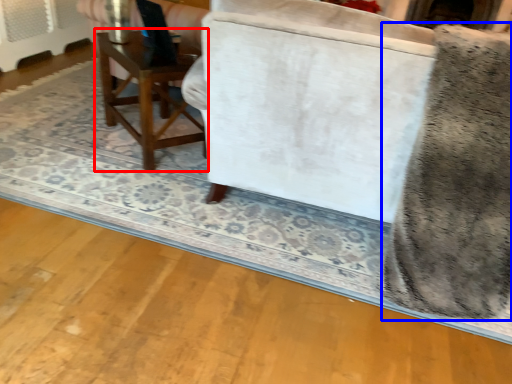
Question: Which point is closer to the camera, table (highlighted by a red box) or swivel chair (highlighted by a blue box)?

Choices:
 (A) table
 (B) swivel chair

Answer: (B)